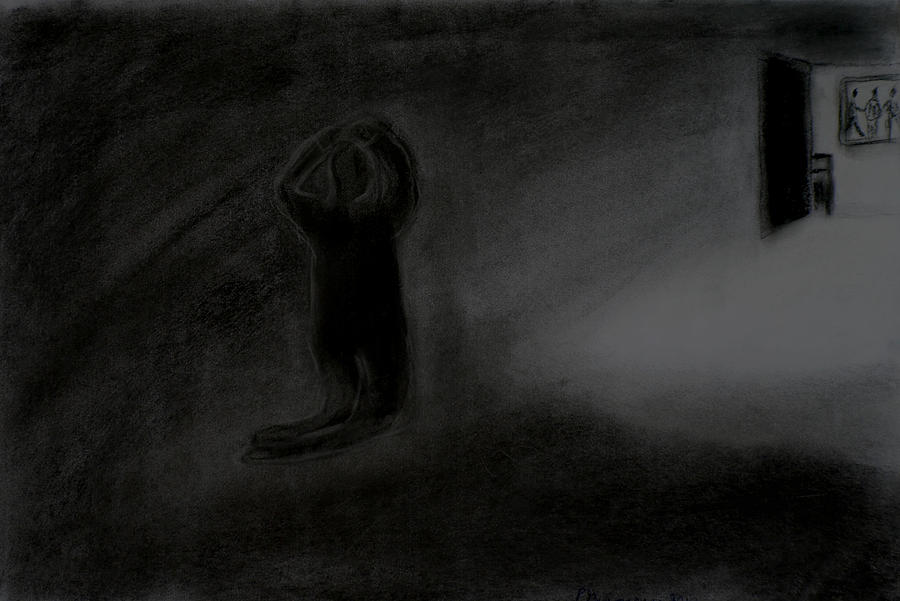
The height and width of the screenshot is (601, 900). I want to click on shadowy end table, so click(824, 166).